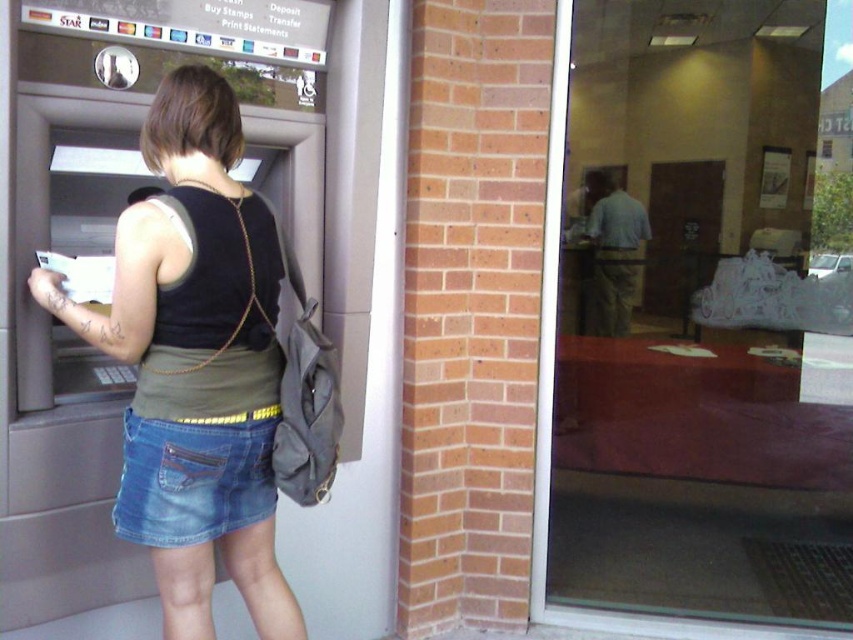
Question: Among these points, which one is nearest to the camera?

Choices:
 (A) (196, 445)
 (B) (260, 259)

Answer: (A)

Question: Among these points, which one is nearest to the camera?

Choices:
 (A) (228, 394)
 (B) (231, 509)

Answer: (A)

Question: In this image, where is denim skirt at center located relative to jeans at lower left?

Choices:
 (A) right
 (B) left

Answer: (B)

Question: Is jeans at lower left positioned behind black matte vest at back?

Choices:
 (A) no
 (B) yes

Answer: (B)

Question: Which of the following is the closest to the observer?

Choices:
 (A) (216, 97)
 (B) (215, 196)
 (C) (207, 481)

Answer: (B)

Question: Does denim skirt at center have a smaller size compared to jeans at lower left?

Choices:
 (A) yes
 (B) no

Answer: (B)